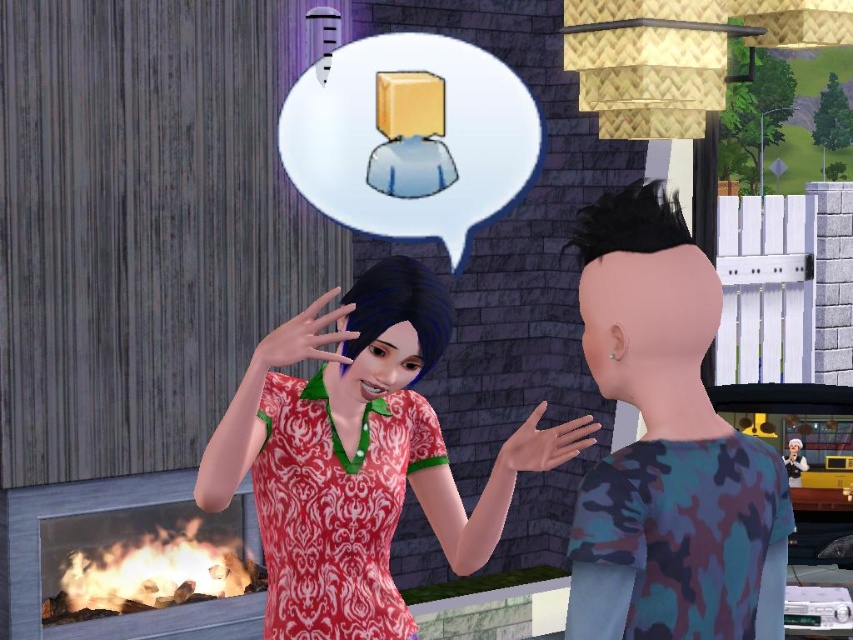
Question: Can you confirm if patterned fabric dress at center is positioned to the left of camouflage shirt at right?

Choices:
 (A) no
 (B) yes

Answer: (B)

Question: Which object appears closest to the camera in this image?

Choices:
 (A) patterned fabric dress at center
 (B) camouflage shirt at right
 (C) dull red fabric dress at center

Answer: (B)

Question: Which point is farther to the camera?

Choices:
 (A) (659, 433)
 (B) (396, 516)

Answer: (B)

Question: Which point is closer to the camera?

Choices:
 (A) (595, 588)
 (B) (375, 564)

Answer: (A)

Question: Is patterned fabric dress at center thinner than camouflage shirt at right?

Choices:
 (A) no
 (B) yes

Answer: (A)

Question: Is camouflage shirt at right above dull red fabric dress at center?

Choices:
 (A) yes
 (B) no

Answer: (A)